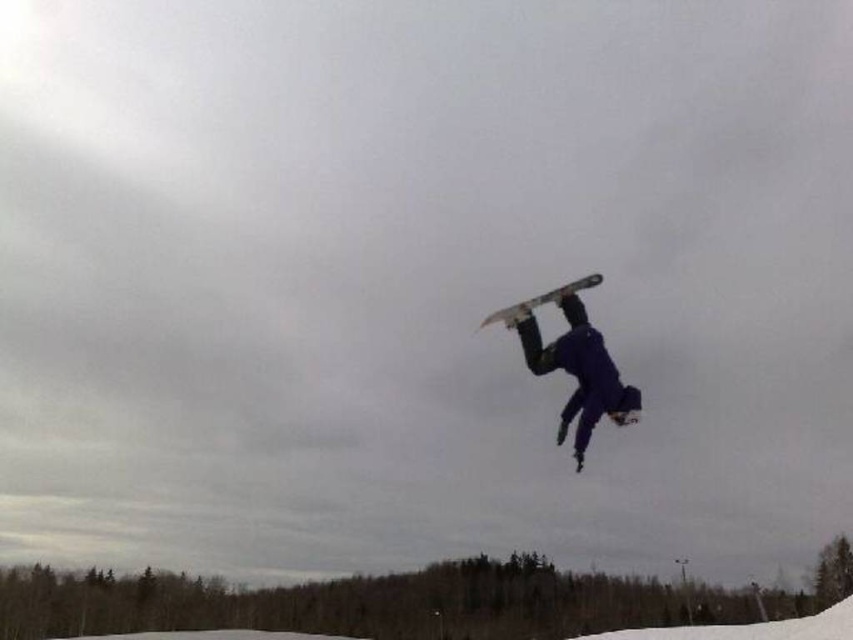
Question: Which of the following is the closest to the observer?

Choices:
 (A) matte gray snowboard at center
 (B) matte black snowboard at center

Answer: (A)

Question: Is matte black snowboard at center in front of matte gray snowboard at center?

Choices:
 (A) no
 (B) yes

Answer: (A)

Question: Which of the following is the farthest from the observer?

Choices:
 (A) matte gray snowboard at center
 (B) matte black snowboard at center

Answer: (B)

Question: Among these objects, which one is nearest to the camera?

Choices:
 (A) matte black snowboard at center
 (B) matte gray snowboard at center

Answer: (B)

Question: Observing the image, what is the correct spatial positioning of matte black snowboard at center in reference to matte gray snowboard at center?

Choices:
 (A) above
 (B) below

Answer: (B)

Question: In this image, where is matte black snowboard at center located relative to matte gray snowboard at center?

Choices:
 (A) right
 (B) left

Answer: (B)